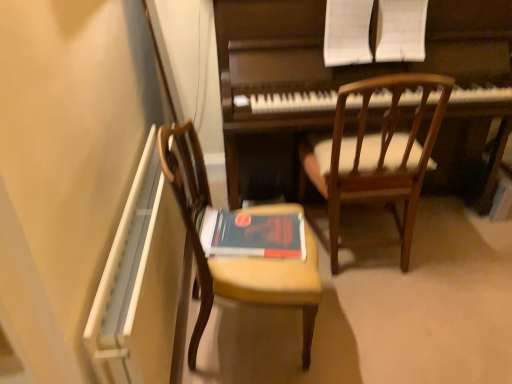
Question: Is wooden chair at left, marked as the 2th chair in a right-to-left arrangement, a part of dark wood piano at center?

Choices:
 (A) no
 (B) yes

Answer: (A)

Question: Is dark wood piano at center smaller than wooden chair at left, marked as the 2th chair in a right-to-left arrangement?

Choices:
 (A) yes
 (B) no

Answer: (B)

Question: From a real-world perspective, does dark wood piano at center sit lower than wooden chair at left, positioned as the first chair in left-to-right order?

Choices:
 (A) yes
 (B) no

Answer: (B)

Question: Can you confirm if dark wood piano at center is wider than wooden chair at left, positioned as the first chair in left-to-right order?

Choices:
 (A) yes
 (B) no

Answer: (A)

Question: Is dark wood piano at center in contact with wooden chair at left, marked as the 2th chair in a right-to-left arrangement?

Choices:
 (A) no
 (B) yes

Answer: (A)

Question: Considering the positions of point (317, 155) and point (273, 269), is point (317, 155) closer or farther from the camera than point (273, 269)?

Choices:
 (A) farther
 (B) closer

Answer: (A)

Question: Looking at the image, does wooden chair at upper right, the second chair from the left, seem bigger or smaller compared to wooden chair at left, positioned as the first chair in left-to-right order?

Choices:
 (A) big
 (B) small

Answer: (A)

Question: From a real-world perspective, is wooden chair at upper right, the 1th chair from the right, positioned above or below wooden chair at left, marked as the 2th chair in a right-to-left arrangement?

Choices:
 (A) below
 (B) above

Answer: (B)

Question: Is wooden chair at upper right, the second chair from the left, in front of or behind wooden chair at left, marked as the 2th chair in a right-to-left arrangement, in the image?

Choices:
 (A) behind
 (B) front

Answer: (A)

Question: Is dark wood piano at center in front of or behind wooden chair at left, positioned as the first chair in left-to-right order, in the image?

Choices:
 (A) behind
 (B) front

Answer: (A)

Question: In the image, is dark wood piano at center on the left side or the right side of wooden chair at left, positioned as the first chair in left-to-right order?

Choices:
 (A) right
 (B) left

Answer: (A)

Question: Considering the positions of point (285, 102) and point (204, 281), is point (285, 102) closer or farther from the camera than point (204, 281)?

Choices:
 (A) farther
 (B) closer

Answer: (A)

Question: Is dark wood piano at center wider or thinner than wooden chair at left, marked as the 2th chair in a right-to-left arrangement?

Choices:
 (A) wide
 (B) thin

Answer: (A)

Question: Is point (182, 203) positioned closer to the camera than point (265, 253)?

Choices:
 (A) closer
 (B) farther

Answer: (A)

Question: Would you say wooden chair at left, positioned as the first chair in left-to-right order, is to the left or to the right of hardcover book at center in the picture?

Choices:
 (A) left
 (B) right

Answer: (A)